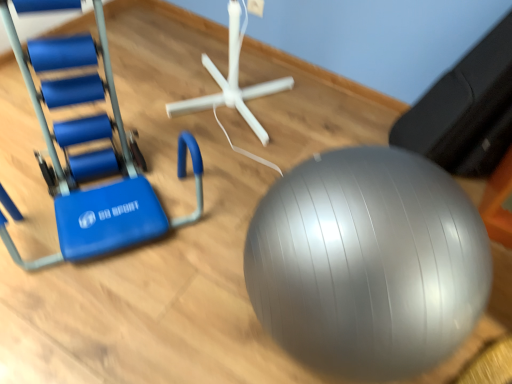
Find the location of a particular element. This screenshot has width=512, height=384. free spot to the right of blue rubber swivel chair at left is located at coordinates (229, 221).